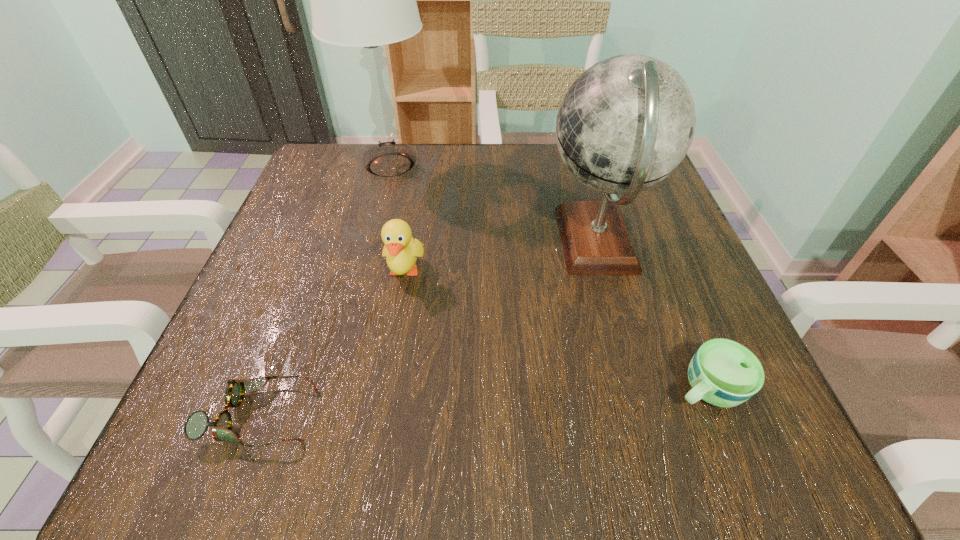
This screenshot has height=540, width=960. Find the location of `object situated at the far left corner`. object situated at the far left corner is located at coordinates (365, 0).

You are a GUI agent. You are given a task and a screenshot of the screen. Output one action in this format:
    pyautogui.click(x=<x>, y=<y>)
    Task: Click on the object that is at the near left corner
    This screenshot has height=540, width=960.
    Given the screenshot: What is the action you would take?
    pyautogui.click(x=197, y=423)

Find the location of a particular element. This screenshot has width=960, height=540. object that is at the near right corner is located at coordinates (724, 373).

Identify the location of vacant point at the far edge. (440, 154).

You are a GUI agent. You are given a task and a screenshot of the screen. Output one action in this format:
    pyautogui.click(x=<x>, y=<y>)
    Task: Click on the vacant space at the near edge
    This screenshot has width=960, height=540.
    Given the screenshot: What is the action you would take?
    pyautogui.click(x=597, y=454)

Locate an element on the screen. The width and height of the screenshot is (960, 540). vacant region at the left edge of the desktop is located at coordinates (287, 288).

Identify the location of free location at the right edge. The image size is (960, 540). (715, 330).

Locate an element on the screen. The width and height of the screenshot is (960, 540). free space at the near left corner of the desktop is located at coordinates (202, 437).

Where is `free space between the second shortest object and the globe`? The height and width of the screenshot is (540, 960). free space between the second shortest object and the globe is located at coordinates (652, 315).

Image resolution: width=960 pixels, height=540 pixels. What are the coordinates of `vacant area between the table lamp and the second shortest object` in the screenshot? It's located at 548,277.